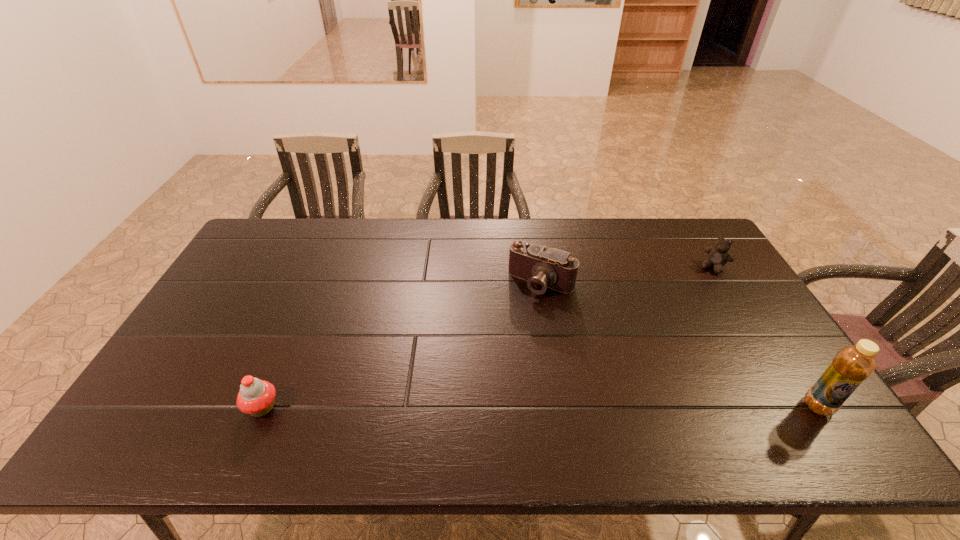
At what (x,y) coordinates should I click in order to perform the action: click on vacant space that's between the cupcake and the tallest object. Please return your answer as a coordinate pair (x, y). This screenshot has height=540, width=960. Looking at the image, I should click on (540, 407).

The height and width of the screenshot is (540, 960). Find the location of `free area in between the camera and the teddy bear`. free area in between the camera and the teddy bear is located at coordinates (628, 275).

Find the location of a particular element. The width and height of the screenshot is (960, 540). vacant point located between the bottle and the teddy bear is located at coordinates (766, 336).

At what (x,y) coordinates should I click in order to perform the action: click on unoccupied position between the teddy bear and the cupcake. Please return your answer as a coordinate pair (x, y). The image size is (960, 540). Looking at the image, I should click on (488, 337).

You are a GUI agent. You are given a task and a screenshot of the screen. Output one action in this format:
    pyautogui.click(x=<x>, y=<y>)
    Task: Click on the blank region between the second object from left to right and the tallest object
    The width and height of the screenshot is (960, 540).
    Given the screenshot: What is the action you would take?
    [680, 345]

The image size is (960, 540). What are the coordinates of `object that is the third closest to the leftmost object` in the screenshot? It's located at pos(718,256).

You are a GUI agent. You are given a task and a screenshot of the screen. Output one action in this format:
    pyautogui.click(x=<x>, y=<y>)
    Task: Click on the object that is the third closest to the teddy bear
    
    Given the screenshot: What is the action you would take?
    pyautogui.click(x=256, y=397)

The height and width of the screenshot is (540, 960). I want to click on blank space that satisfies the following two spatial constraints: 1. on the back side of the cupcake; 2. on the left side of the teddy bear, so click(x=322, y=267).

Locate an element on the screen. The width and height of the screenshot is (960, 540). vacant area in the image that satisfies the following two spatial constraints: 1. on the front side of the camera; 2. on the right side of the tallest object is located at coordinates (561, 406).